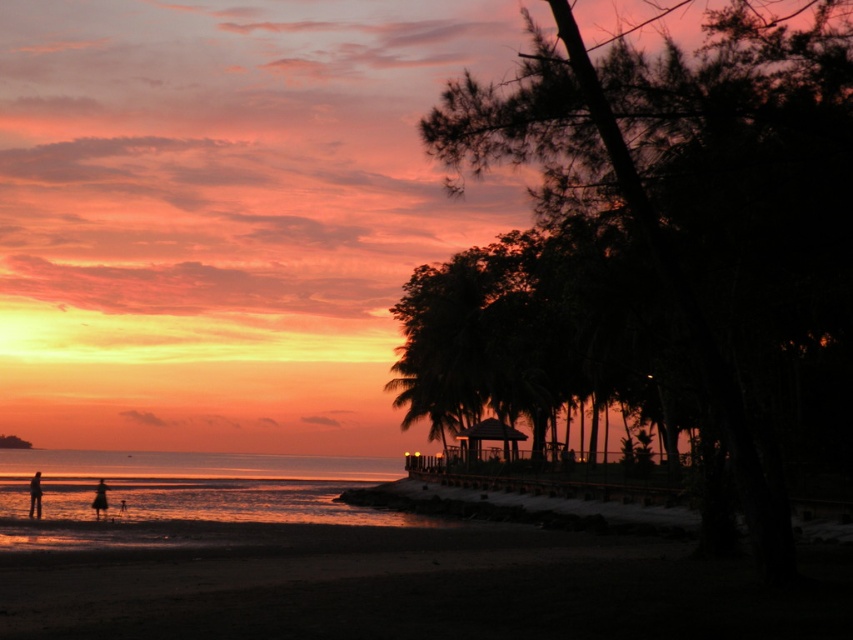
From the picture: Between dark sand at lower left and sandy water at lower left, which one appears on the left side from the viewer's perspective?

From the viewer's perspective, sandy water at lower left appears more on the left side.

Between dark sand at lower left and sandy water at lower left, which one is positioned lower?

sandy water at lower left is below.

Does point (833, 593) come closer to viewer compared to point (154, 481)?

Yes, it is in front of point (154, 481).

Find the location of a particular element. dark sand at lower left is located at coordinates (408, 586).